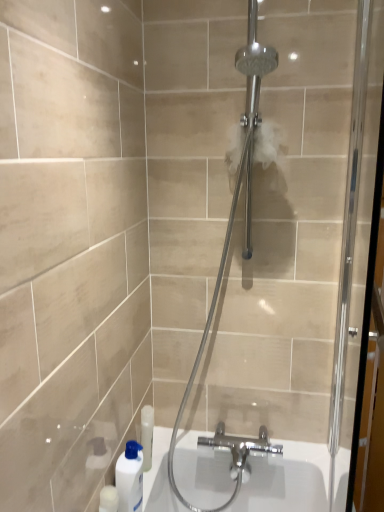
Question: Is clear glass shower door at center next to white glossy bottle at lower left and touching it?

Choices:
 (A) no
 (B) yes

Answer: (A)

Question: Does clear glass shower door at center have a greater height compared to white glossy bottle at lower left?

Choices:
 (A) no
 (B) yes

Answer: (B)

Question: Does clear glass shower door at center have a smaller size compared to white glossy bottle at lower left?

Choices:
 (A) no
 (B) yes

Answer: (A)

Question: Does clear glass shower door at center come behind white glossy bottle at lower left?

Choices:
 (A) no
 (B) yes

Answer: (A)

Question: Does clear glass shower door at center appear on the left side of white glossy bottle at lower left?

Choices:
 (A) yes
 (B) no

Answer: (B)

Question: From the image's perspective, is clear glass shower door at center located above white glossy bottle at lower left?

Choices:
 (A) no
 (B) yes

Answer: (B)

Question: Is clear glass screen door at right located within clear glass shower door at center?

Choices:
 (A) no
 (B) yes

Answer: (A)

Question: From the image's perspective, is clear glass shower door at center below clear glass screen door at right?

Choices:
 (A) no
 (B) yes

Answer: (A)

Question: Can you confirm if clear glass shower door at center is shorter than clear glass screen door at right?

Choices:
 (A) yes
 (B) no

Answer: (B)

Question: From a real-world perspective, does clear glass shower door at center sit lower than clear glass screen door at right?

Choices:
 (A) yes
 (B) no

Answer: (A)

Question: Is clear glass shower door at center at the right side of clear glass screen door at right?

Choices:
 (A) yes
 (B) no

Answer: (B)

Question: Is clear glass shower door at center positioned with its back to clear glass screen door at right?

Choices:
 (A) no
 (B) yes

Answer: (A)

Question: Considering the relative positions of white glossy bottle at lower left and clear glass shower door at center in the image provided, is white glossy bottle at lower left to the right of clear glass shower door at center from the viewer's perspective?

Choices:
 (A) no
 (B) yes

Answer: (A)